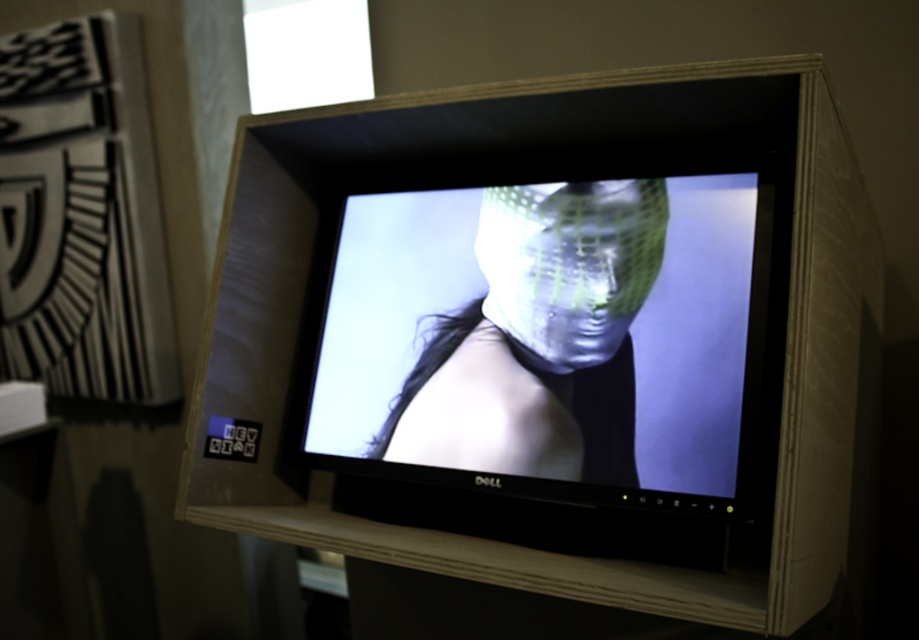
In the scene shown: You are an interior designer arranging masks on a shelf. You have a metallic mesh mask at center and a translucent plastic mask at center. According to the scene, which mask is closer to the viewer?

The metallic mesh mask at center is closer to the viewer as it is in front of the translucent plastic mask at center.

You are a designer evaluating two masks displayed on a monitor. The metallic mesh mask at center and the translucent plastic mask at center are both shown. Which mask appears larger in height on the screen?

The metallic mesh mask at center is much taller than the translucent plastic mask at center, so it appears larger in height on the screen.